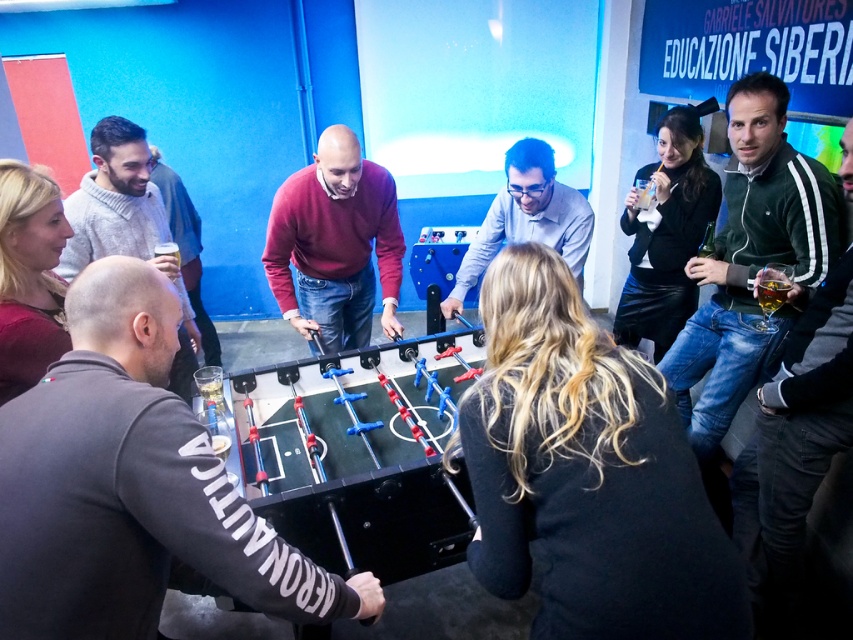
Question: Which point appears closest to the camera in this image?

Choices:
 (A) (596, 609)
 (B) (244, 413)
 (C) (537, 157)
 (D) (160, 163)

Answer: (A)

Question: Is black matte shirt at center to the left of metallic blue foosball table at center from the viewer's perspective?

Choices:
 (A) no
 (B) yes

Answer: (A)

Question: Does metallic blue foosball table at center appear under translucent glass at upper center?

Choices:
 (A) no
 (B) yes

Answer: (B)

Question: Considering the relative positions of green fleece jacket at upper right and dark gray sweater at lower left in the image provided, where is green fleece jacket at upper right located with respect to dark gray sweater at lower left?

Choices:
 (A) below
 (B) above

Answer: (A)

Question: Estimate the real-world distances between objects in this image. Which object is closer to the black leather jacket at upper right?

Choices:
 (A) translucent glass beer at center
 (B) gray sweater at center
 (C) green jersey at right

Answer: (A)

Question: Which is nearer to the dark gray sweatshirt at center?

Choices:
 (A) green fleece jacket at upper right
 (B) maroon sweater at center
 (C) translucent glass at upper center

Answer: (B)